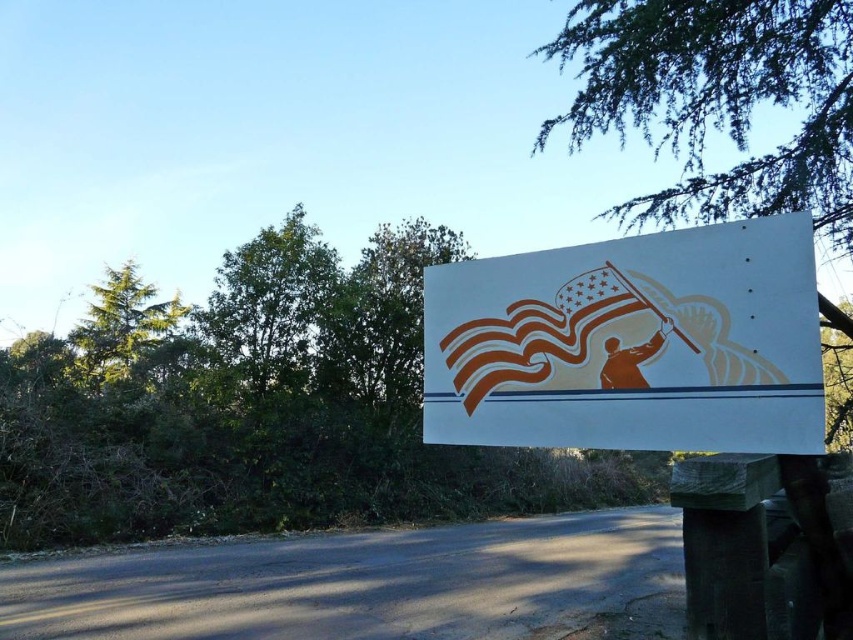
You are a driver approaching the white matte sign at center and the green leafy tree at upper left. Which object is closer to the road?

The white matte sign at center is closer to the road than the green leafy tree at upper left because it is positioned over it.